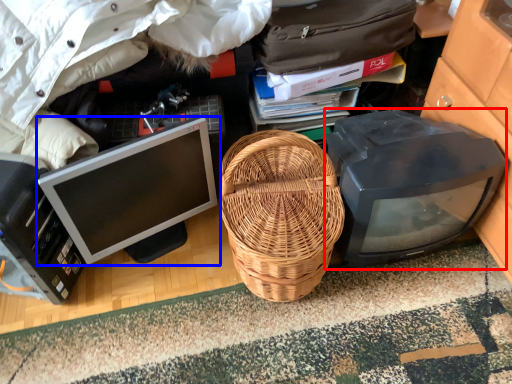
Question: Among these objects, which one is nearest to the camera, computer monitor (highlighted by a red box) or computer monitor (highlighted by a blue box)?

Choices:
 (A) computer monitor
 (B) computer monitor

Answer: (B)